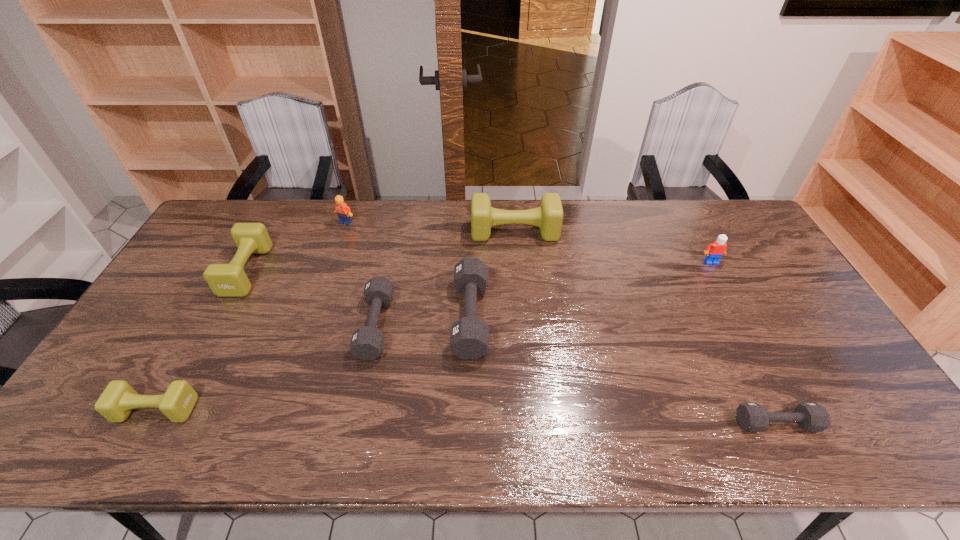
Locate an element on the screen. The width and height of the screenshot is (960, 540). vacant space located on the back of the nearest gray dumbbell is located at coordinates (x=757, y=386).

At what (x,y) coordinates should I click in order to perform the action: click on dumbbell located in the far edge section of the desktop. Please return your answer as a coordinate pair (x, y). The width and height of the screenshot is (960, 540). Looking at the image, I should click on (548, 217).

This screenshot has height=540, width=960. Identify the location of Lego that is at the far edge. (343, 211).

Image resolution: width=960 pixels, height=540 pixels. What are the coordinates of `object that is at the near left corner` in the screenshot? It's located at (118, 399).

Locate an element on the screen. This screenshot has width=960, height=540. blank space at the far edge of the desktop is located at coordinates (450, 219).

What are the coordinates of `free space at the near edge of the desktop` in the screenshot? It's located at (422, 447).

Locate an element on the screen. The image size is (960, 540). vacant area at the far left corner is located at coordinates (234, 207).

The image size is (960, 540). I want to click on vacant area at the near left corner, so click(x=131, y=432).

The image size is (960, 540). Find the location of `vacant space in between the second biggest olive dumbbell and the second gray dumbbell from left to right`. vacant space in between the second biggest olive dumbbell and the second gray dumbbell from left to right is located at coordinates point(359,294).

Identify the location of blank region between the biggest gray dumbbell and the shortest dumbbell. This screenshot has height=540, width=960. (623, 370).